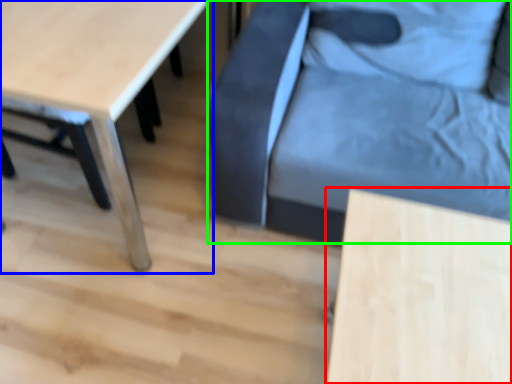
Question: Estimate the real-world distances between objects in this image. Which object is farther from table (highlighted by a red box), table (highlighted by a blue box) or swivel chair (highlighted by a green box)?

Choices:
 (A) table
 (B) swivel chair

Answer: (A)